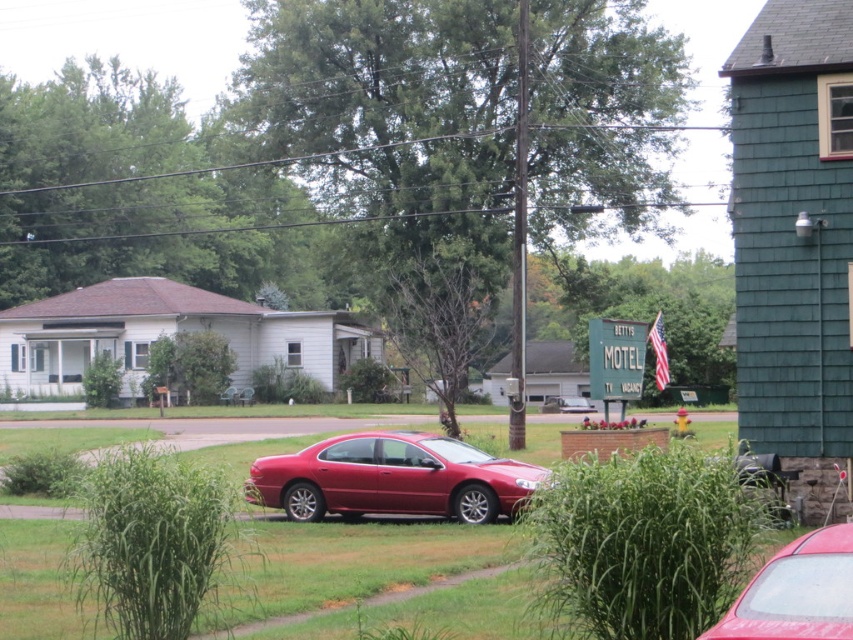
Question: Can you confirm if green grass at center is smaller than glossy red car at lower right?

Choices:
 (A) no
 (B) yes

Answer: (A)

Question: Does green grass at center have a smaller size compared to glossy red sedan at center?

Choices:
 (A) yes
 (B) no

Answer: (B)

Question: Can you confirm if green grass at center is positioned below glossy red sedan at center?

Choices:
 (A) yes
 (B) no

Answer: (A)

Question: Among these points, which one is nearest to the camera?

Choices:
 (A) (769, 566)
 (B) (312, 452)
 (C) (479, 550)

Answer: (A)

Question: Which of these objects is positioned farthest from the glossy red sedan at center?

Choices:
 (A) glossy red car at lower right
 (B) green grass at center

Answer: (A)

Question: Which object is closer to the camera taking this photo?

Choices:
 (A) glossy red sedan at center
 (B) glossy red car at lower right
 (C) green grass at center

Answer: (B)